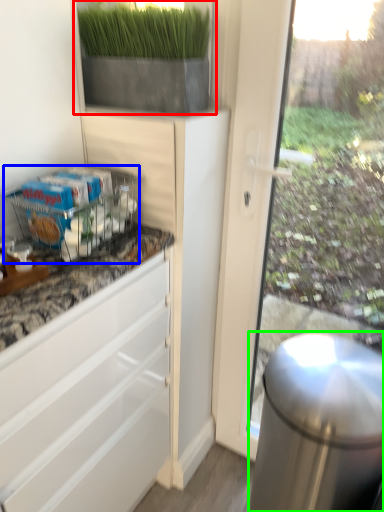
Question: Which object is the farthest from houseplant (highlighted by a red box)? Choose among these: shelf (highlighted by a blue box) or appliance (highlighted by a green box).

Choices:
 (A) shelf
 (B) appliance

Answer: (B)